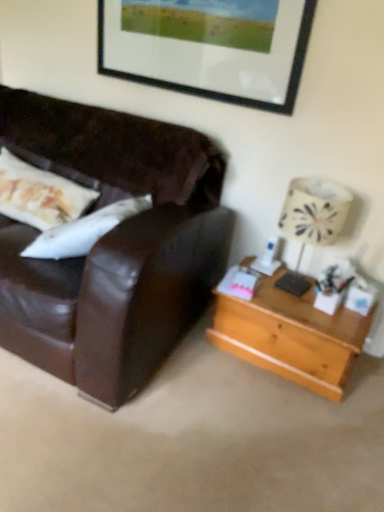
Question: Is light brown wooden table at right at the right side of white fabric lampshade at right?

Choices:
 (A) no
 (B) yes

Answer: (A)

Question: Is light brown wooden table at right not inside white fabric lampshade at right?

Choices:
 (A) no
 (B) yes

Answer: (B)

Question: From the image's perspective, would you say light brown wooden table at right is shown under white fabric lampshade at right?

Choices:
 (A) no
 (B) yes

Answer: (B)

Question: Can you confirm if light brown wooden table at right is smaller than white fabric lampshade at right?

Choices:
 (A) no
 (B) yes

Answer: (A)

Question: From a real-world perspective, is light brown wooden table at right physically above white fabric lampshade at right?

Choices:
 (A) no
 (B) yes

Answer: (A)

Question: Is black matte picture frame at upper center spatially inside white fabric lampshade at right, or outside of it?

Choices:
 (A) inside
 (B) outside

Answer: (B)

Question: In the image, is black matte picture frame at upper center positioned in front of or behind white fabric lampshade at right?

Choices:
 (A) behind
 (B) front

Answer: (A)

Question: Does point (158, 12) appear closer or farther from the camera than point (304, 196)?

Choices:
 (A) closer
 (B) farther

Answer: (B)

Question: Is black matte picture frame at upper center taller or shorter than white fabric lampshade at right?

Choices:
 (A) short
 (B) tall

Answer: (A)

Question: Considering the positions of light brown wooden table at right and white fabric lampshade at right in the image, is light brown wooden table at right wider or thinner than white fabric lampshade at right?

Choices:
 (A) wide
 (B) thin

Answer: (A)

Question: Considering their positions, is light brown wooden table at right located in front of or behind white fabric lampshade at right?

Choices:
 (A) front
 (B) behind

Answer: (B)

Question: Based on their positions, is light brown wooden table at right located to the left or right of white fabric lampshade at right?

Choices:
 (A) right
 (B) left

Answer: (B)

Question: Considering the positions of light brown wooden table at right and white fabric lampshade at right in the image, is light brown wooden table at right taller or shorter than white fabric lampshade at right?

Choices:
 (A) tall
 (B) short

Answer: (B)

Question: From the image's perspective, is black matte picture frame at upper center above or below light brown wooden table at right?

Choices:
 (A) below
 (B) above

Answer: (B)

Question: In terms of width, does black matte picture frame at upper center look wider or thinner when compared to light brown wooden table at right?

Choices:
 (A) thin
 (B) wide

Answer: (A)